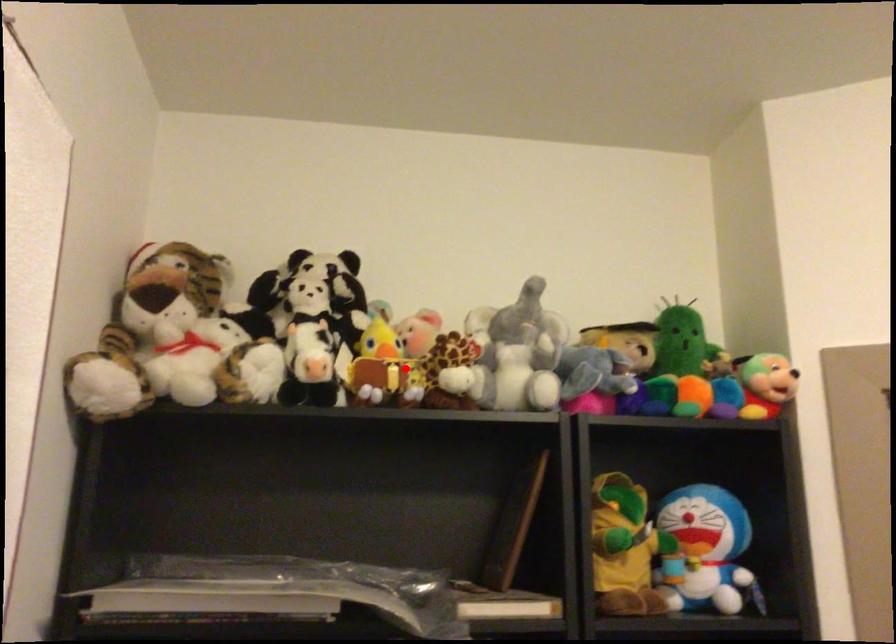
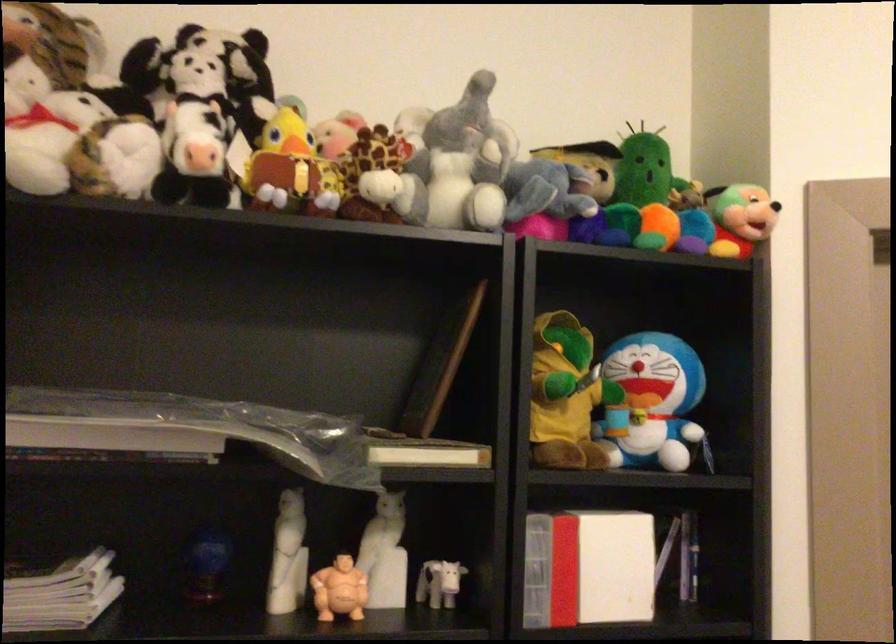
Question: A red point is marked in image1. In image2, is the corresponding 3D point closer to the camera or farther? Reply with the corresponding letter.

Choices:
 (A) The corresponding 3D point is closer.
 (B) The corresponding 3D point is farther.

Answer: (A)